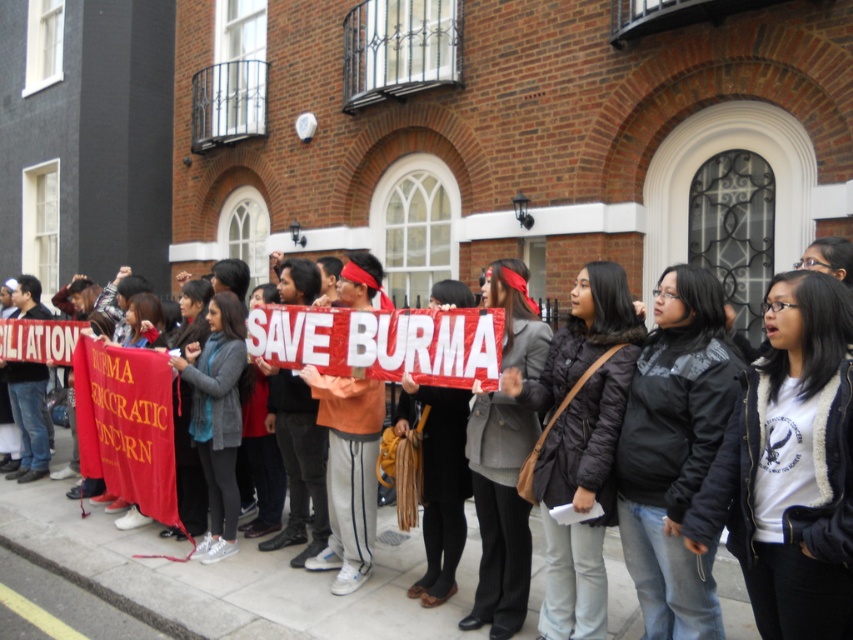
Is gray fabric jacket at center above matte black coat at center?

Yes.

Does gray fabric jacket at center have a lesser height compared to matte black coat at center?

Incorrect, gray fabric jacket at center's height does not fall short of matte black coat at center's.

Locate an element on the screen. The height and width of the screenshot is (640, 853). gray fabric jacket at center is located at coordinates (218, 417).

Is matte gray blazer at center closer to camera compared to matte black jacket at center?

Yes, it is.

Can you confirm if matte gray blazer at center is wider than matte black jacket at center?

Yes, matte gray blazer at center is wider than matte black jacket at center.

In order to click on matte gray blazer at center in this screenshot , I will do `click(498, 509)`.

Is red fabric banner at center behind white fleece jacket at center?

Yes, it is.

How far apart are red fabric banner at center and white fleece jacket at center?

red fabric banner at center and white fleece jacket at center are 9.74 feet apart.

Who is more forward, (271, 556) or (776, 353)?

Point (776, 353) is in front.

Locate an element on the screen. red fabric banner at center is located at coordinates (231, 577).